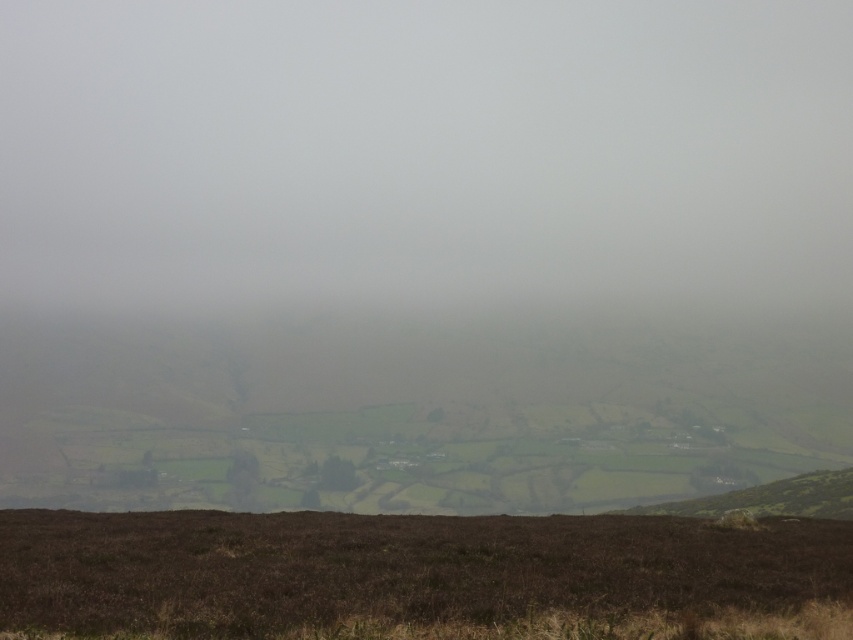
Can you confirm if white matte fog at center is taller than brown rough grass at bottom?

Indeed, white matte fog at center has a greater height compared to brown rough grass at bottom.

Who is taller, white matte fog at center or brown rough grass at bottom?

white matte fog at center is taller.

I want to click on white matte fog at center, so click(x=425, y=156).